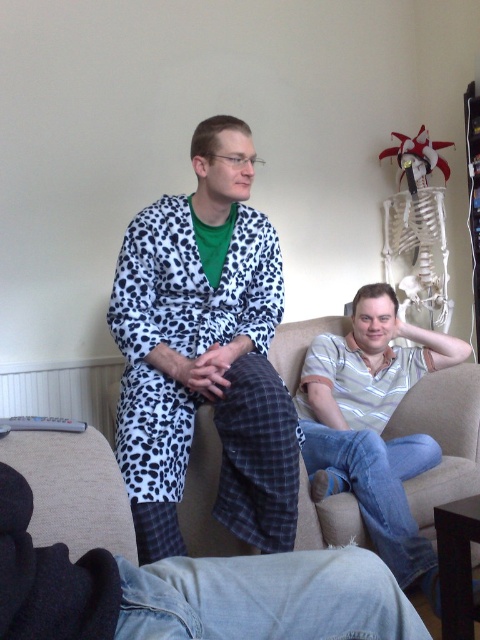
You are trying to organize clothes in a closet. You have a denim pants at lower center and a striped cotton shirt at center. According to the image, where should you place the denim pants relative to the striped cotton shirt?

The denim pants at lower center should be placed below the striped cotton shirt at center as per the image.

You are an interior designer planning to place a new sofa in the living room. The sofa will be positioned at point 0.613, 0.406. Where should you place the sofa so that it does not interfere with the white leopard print robe at left?

The sofa should be placed away from the white leopard print robe at left located at point (194, 392) to avoid interference.